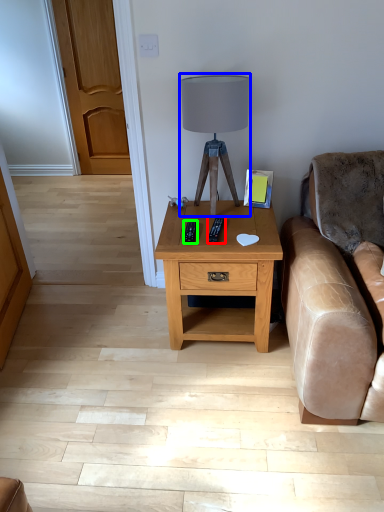
Question: Considering the real-world distances, which object is closest to remote (highlighted by a red box)? table lamp (highlighted by a blue box) or remote (highlighted by a green box).

Choices:
 (A) table lamp
 (B) remote

Answer: (B)